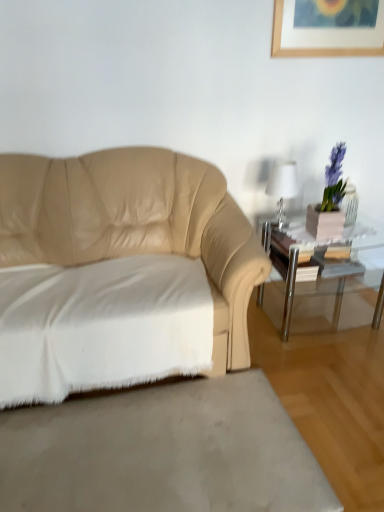
You are a GUI agent. You are given a task and a screenshot of the screen. Output one action in this format:
    pyautogui.click(x=<x>, y=<y>)
    Task: Click on the vacant area that lies in front of clear glass table at right
    
    Given the screenshot: What is the action you would take?
    pyautogui.click(x=332, y=374)